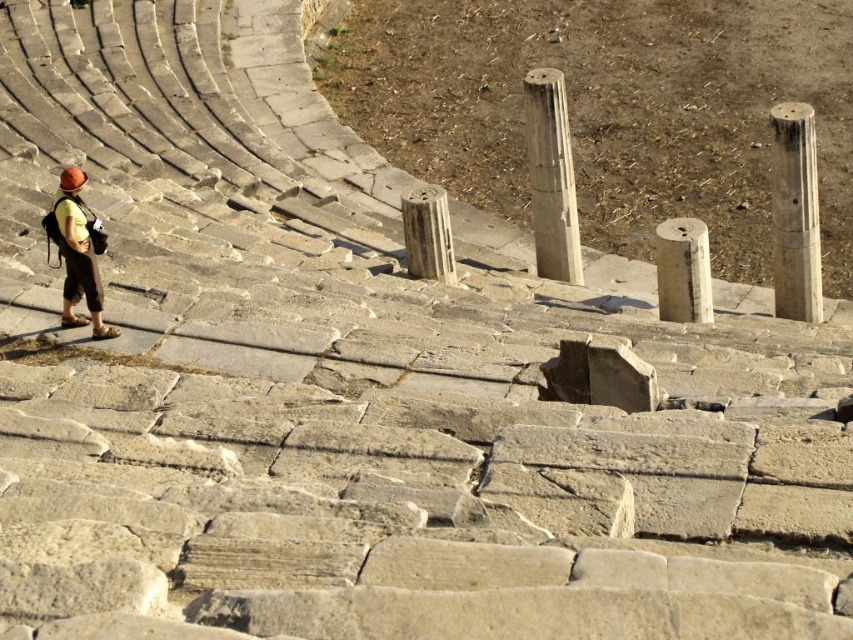
Can you confirm if matte yellow shirt at lower left is positioned above gray stone column at center?

Correct, matte yellow shirt at lower left is located above gray stone column at center.

Identify the location of matte yellow shirt at lower left. Image resolution: width=853 pixels, height=640 pixels. (78, 256).

Who is more distant from viewer, (x=71, y=260) or (x=408, y=241)?

The point (x=408, y=241) is behind.

Find the location of `matte yellow shirt at lower left`. matte yellow shirt at lower left is located at coordinates (78, 256).

Is point (535, 76) more distant than point (76, 268)?

Yes, point (535, 76) is farther from viewer.

Measure the distance between point (555, 212) and camera.

They are 52.16 meters apart.

Is point (556, 147) positioned behind point (61, 173)?

No, it is not.

You are a GUI agent. You are given a task and a screenshot of the screen. Output one action in this format:
    pyautogui.click(x=<x>, y=<y>)
    Task: Click on the smooth stone column at center
    This screenshot has height=640, width=853.
    Given the screenshot: What is the action you would take?
    pyautogui.click(x=550, y=177)

Who is higher up, smooth stone column at center or smooth gray pillar at center-right?

smooth stone column at center is above.

Does smooth stone column at center have a lesser width compared to smooth gray pillar at center-right?

Indeed, smooth stone column at center has a lesser width compared to smooth gray pillar at center-right.

Who is more distant from viewer, (555, 218) or (656, 264)?

The point (656, 264) is more distant.

The image size is (853, 640). Identify the location of smooth stone column at center. (550, 177).